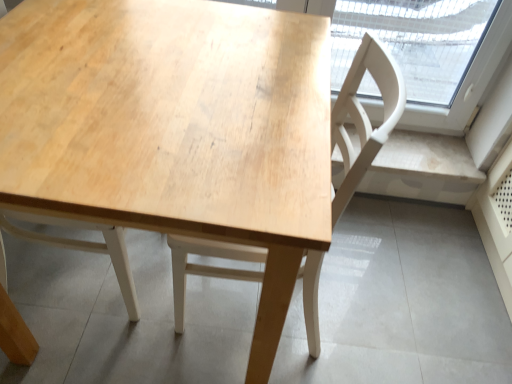
Identify the location of free spot to the right of natural wood table at center. (395, 304).